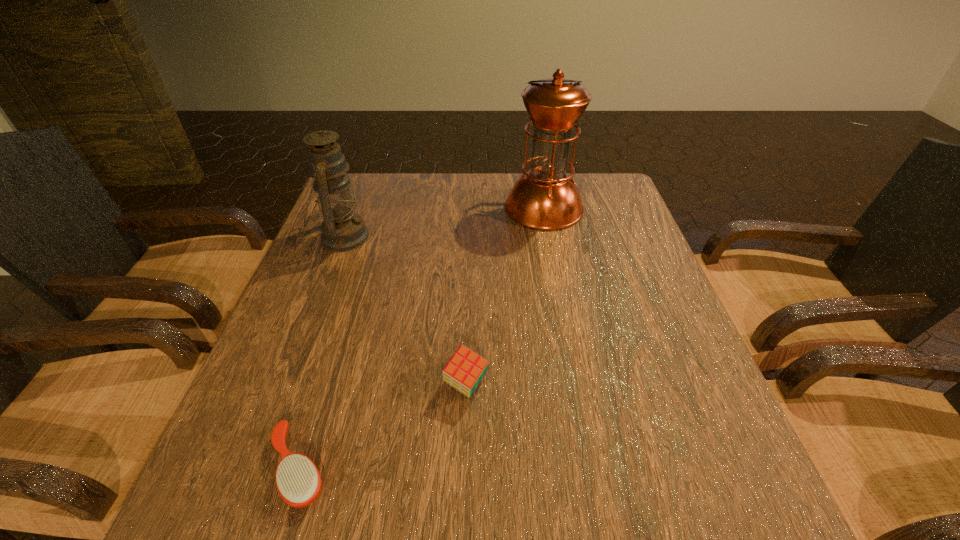
Find the location of a particular element. The image size is (960, 540). empty location between the third shortest object and the nearest object is located at coordinates (321, 352).

Where is `free space between the shorter oil lamp and the right oil lamp`? The image size is (960, 540). free space between the shorter oil lamp and the right oil lamp is located at coordinates (444, 222).

Where is `free space between the nearest object and the left oil lamp`? free space between the nearest object and the left oil lamp is located at coordinates (321, 352).

Identify the location of the closest object to the nearest object. This screenshot has height=540, width=960. (465, 370).

Where is `object that can be found as the third closest to the tallest object`? object that can be found as the third closest to the tallest object is located at coordinates (298, 481).

At what (x,y) coordinates should I click in order to perform the action: click on free space in the image that satisfies the following two spatial constraints: 1. on the back side of the taller oil lamp; 2. on the left side of the shorter oil lamp. Please return your answer as a coordinate pair (x, y). Looking at the image, I should click on (353, 208).

The height and width of the screenshot is (540, 960). What are the coordinates of `vacant point that satisfies the following two spatial constraints: 1. on the front side of the third farthest object; 2. on the left side of the second tallest object` in the screenshot? It's located at (286, 384).

Find the location of `free location that satisfies the following two spatial constraints: 1. on the back side of the shortest object; 2. on the left side of the tallest object`. free location that satisfies the following two spatial constraints: 1. on the back side of the shortest object; 2. on the left side of the tallest object is located at coordinates (378, 208).

The height and width of the screenshot is (540, 960). Find the location of `vacant space that satisfies the following two spatial constraints: 1. on the back side of the third farthest object; 2. on the right side of the shortest object`. vacant space that satisfies the following two spatial constraints: 1. on the back side of the third farthest object; 2. on the right side of the shortest object is located at coordinates (324, 384).